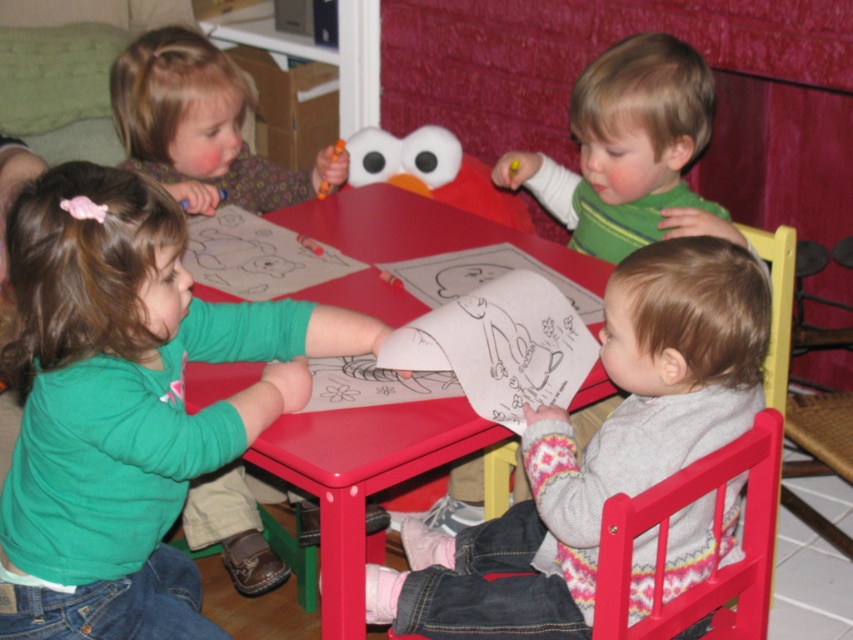
Which is in front, point (141, 365) or point (668, 92)?

Point (141, 365) is in front.

Is point (113, 300) positioned in front of point (523, 480)?

That is True.

At what (x,y) coordinates should I click in order to perform the action: click on green matte shirt at left. Please return your answer as a coordinate pair (x, y). Looking at the image, I should click on (128, 401).

Identify the location of green matte shirt at left. (128, 401).

Which is more to the right, green matte shirt at left or red plastic table at center?

From the viewer's perspective, red plastic table at center appears more on the right side.

Who is more forward, (165,244) or (338,192)?

Point (165,244) is more forward.

Locate an element on the screen. This screenshot has width=853, height=640. green matte shirt at left is located at coordinates (128, 401).

Is point (601, 116) positioned after point (421, 316)?

Yes.

Locate an element on the screen. smooth green shirt at center is located at coordinates (630, 150).

Is point (589, 224) positioned after point (566, 316)?

That is True.

Identify the location of smooth green shirt at center. (630, 150).